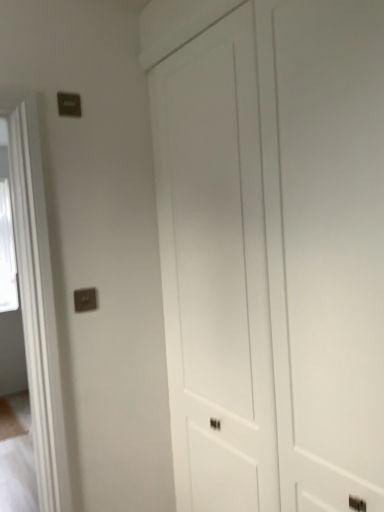
Question: In terms of width, does white matte door at center look wider or thinner when compared to matte silver switch at upper left?

Choices:
 (A) wide
 (B) thin

Answer: (A)

Question: Relative to matte silver switch at upper left, is white matte door at center in front or behind?

Choices:
 (A) front
 (B) behind

Answer: (A)

Question: From their relative heights in the image, would you say white matte door at center is taller or shorter than matte silver switch at upper left?

Choices:
 (A) tall
 (B) short

Answer: (A)

Question: Considering the positions of matte silver switch at upper left and white matte door at center in the image, is matte silver switch at upper left wider or thinner than white matte door at center?

Choices:
 (A) wide
 (B) thin

Answer: (B)

Question: Is matte silver switch at upper left in front of or behind white matte door at center in the image?

Choices:
 (A) behind
 (B) front

Answer: (A)

Question: From a real-world perspective, is matte silver switch at upper left positioned above or below white matte door at center?

Choices:
 (A) below
 (B) above

Answer: (B)

Question: Based on their positions, is matte silver switch at upper left located to the left or right of white matte door at center?

Choices:
 (A) left
 (B) right

Answer: (A)